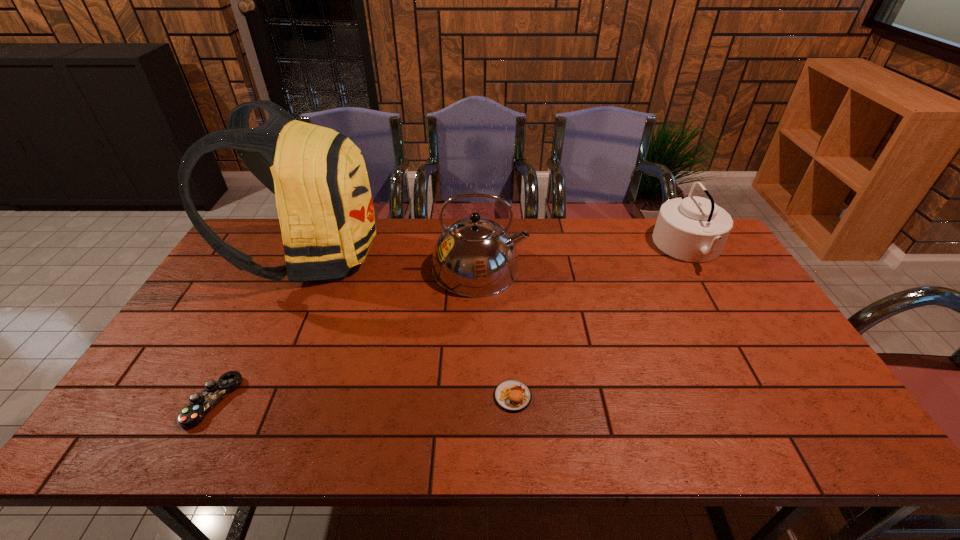
Identify the location of the tallest object. 320,180.

Find the location of a particular element. This screenshot has width=960, height=540. the left kettle is located at coordinates (474, 257).

The width and height of the screenshot is (960, 540). What are the coordinates of `the taller kettle` in the screenshot? It's located at (474, 257).

Where is `the right kettle`? This screenshot has height=540, width=960. the right kettle is located at coordinates (694, 229).

Where is `the shorter kettle`? The width and height of the screenshot is (960, 540). the shorter kettle is located at coordinates (694, 229).

Where is `patty`? The width and height of the screenshot is (960, 540). patty is located at coordinates (512, 395).

Find the location of a particular element. This screenshot has width=960, height=540. the shortest object is located at coordinates (200, 404).

This screenshot has width=960, height=540. What are the coordinates of `free space located 0.300m on the front-facing side of the tallest object` in the screenshot? It's located at click(471, 255).

At what (x,y) coordinates should I click in order to perform the action: click on free location located 0.370m from the spout of the taller kettle. Please return your answer as a coordinate pair (x, y). Looking at the image, I should click on (641, 268).

Identify the location of blank space located on the spout of the rightmost object. (562, 247).